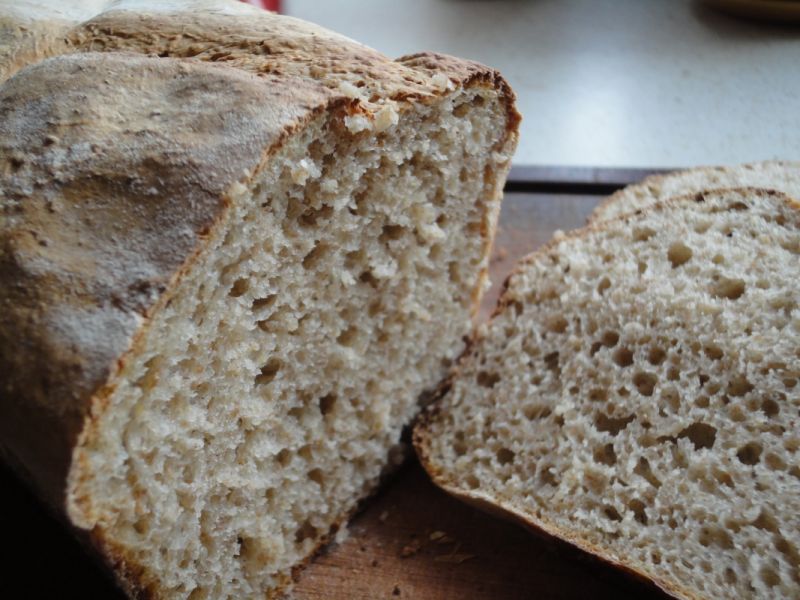
I want to click on crumb, so click(394, 120), click(305, 167), click(340, 536), click(432, 532).